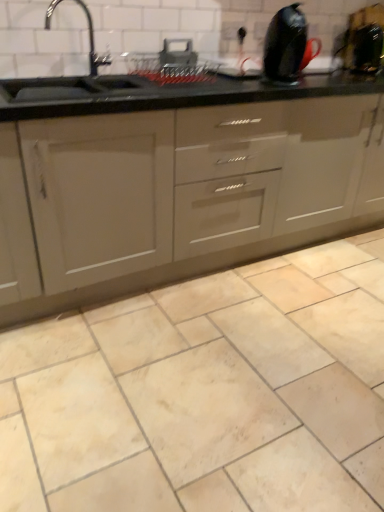
Question: Is metallic silver rack at upper center, the 1th appliance in the left-to-right sequence, taller or shorter than metallic silver toaster at upper center, acting as the 2th appliance starting from the left?

Choices:
 (A) tall
 (B) short

Answer: (B)

Question: Is metallic silver rack at upper center, acting as the 4th appliance starting from the right, wider or thinner than metallic silver toaster at upper center, acting as the 2th appliance starting from the left?

Choices:
 (A) wide
 (B) thin

Answer: (A)

Question: Estimate the real-world distances between objects in this image. Which object is farther from the matte gray cabinet at center?

Choices:
 (A) metallic silver toaster at upper center, the 3th appliance viewed from the right
 (B) glossy black kettle at upper right, positioned as the 2th appliance in right-to-left order
 (C) black glossy kettle at upper right, the 4th appliance viewed from the left
 (D) beige marble tile at center
 (E) metallic silver rack at upper center, the 1th appliance in the left-to-right sequence

Answer: (C)

Question: Which is farther from the metallic silver toaster at upper center, acting as the 2th appliance starting from the left?

Choices:
 (A) matte gray cabinet at center
 (B) black glossy kettle at upper right, which is the 1th appliance from right to left
 (C) beige marble tile at center
 (D) glossy black kettle at upper right, arranged as the 3th appliance when viewed from the left
 (E) metallic silver rack at upper center, the 1th appliance in the left-to-right sequence

Answer: (C)